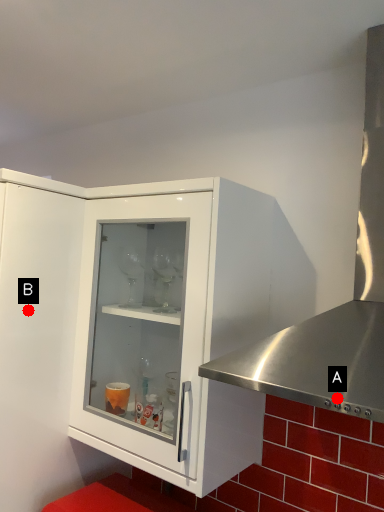
Question: Two points are circled on the image, labeled by A and B beside each circle. Which point is closer to the camera taking this photo?

Choices:
 (A) A is closer
 (B) B is closer

Answer: (A)